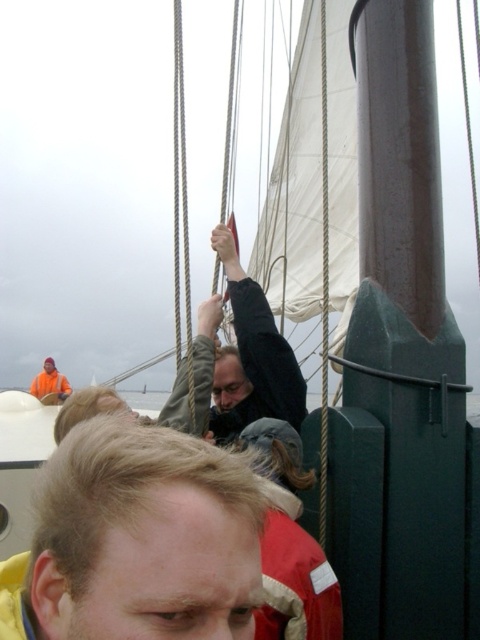
Can you confirm if dark gray fabric at center is taller than white cord at center?

No.

This screenshot has height=640, width=480. I want to click on dark gray fabric at center, so click(252, 356).

At what (x,y) coordinates should I click in order to perform the action: click on dark gray fabric at center. Please return your answer as a coordinate pair (x, y). Looking at the image, I should click on (252, 356).

Is white cord at center wider than orange fabric life jacket at left?

No, white cord at center is not wider than orange fabric life jacket at left.

Does white cord at center appear over orange fabric life jacket at left?

Yes, white cord at center is above orange fabric life jacket at left.

Who is more forward, (323,128) or (66,396)?

Point (323,128)

The height and width of the screenshot is (640, 480). Identify the location of white cord at center. (324, 285).

Does blonde hair at lower left have a lesser height compared to red fleece life jacket at lower center?

In fact, blonde hair at lower left may be taller than red fleece life jacket at lower center.

Does blonde hair at lower left have a greater width compared to red fleece life jacket at lower center?

Yes, blonde hair at lower left is wider than red fleece life jacket at lower center.

Where is `blonde hair at lower left`? The width and height of the screenshot is (480, 640). blonde hair at lower left is located at coordinates (137, 540).

At what (x,y) coordinates should I click in order to perform the action: click on blonde hair at lower left. Please return your answer as a coordinate pair (x, y). Looking at the image, I should click on (137, 540).